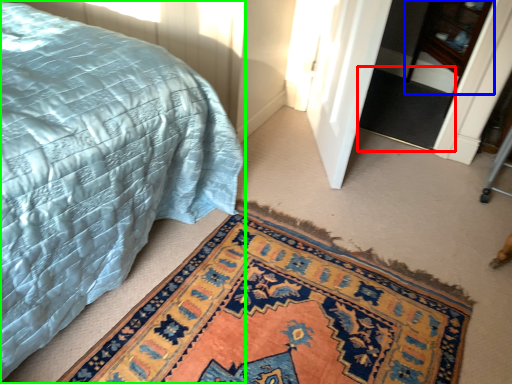
Question: Which object is the closest to the doormat (highlighted by a red box)? Choose among these: dresser (highlighted by a blue box) or bed (highlighted by a green box).

Choices:
 (A) dresser
 (B) bed

Answer: (A)